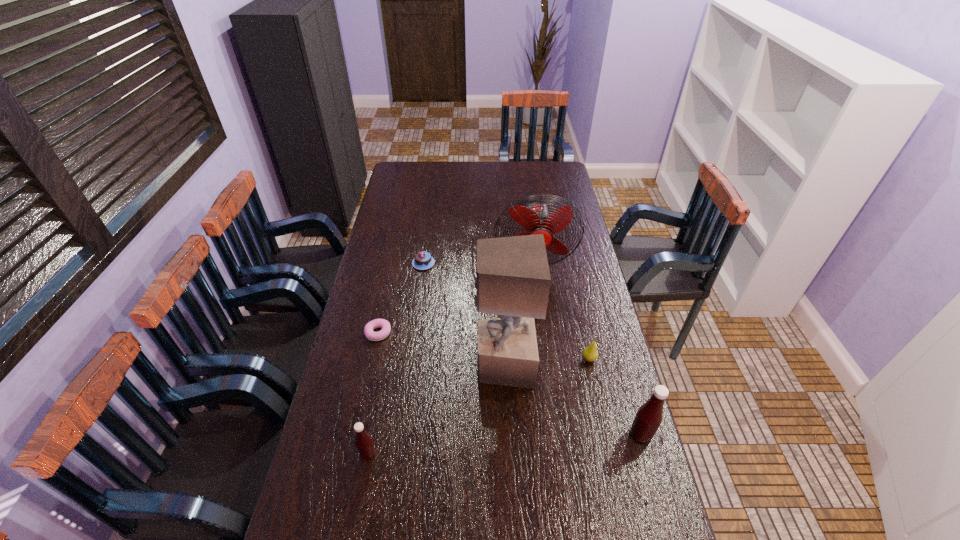
This screenshot has width=960, height=540. Identify the location of pastry that is positioned at the left edge. (377, 323).

Identify the location of Tabasco sauce situated at the right edge. (649, 416).

Where is `fan that is at the right edge`? fan that is at the right edge is located at coordinates pyautogui.click(x=536, y=219).

The image size is (960, 540). In order to click on pear situated at the right edge in this screenshot , I will do `click(590, 353)`.

The height and width of the screenshot is (540, 960). In order to click on vacant space at the far edge of the desktop in this screenshot , I will do `click(503, 184)`.

In the image, there is a desktop. Find the location of `free space at the left edge`. free space at the left edge is located at coordinates (393, 289).

Find the location of a particular element. vacant space at the right edge is located at coordinates coord(587,363).

At what (x,y) coordinates should I click in order to perform the action: click on vacant region at the far left corner of the desktop. Please return your answer as a coordinate pair (x, y). This screenshot has height=540, width=960. Looking at the image, I should click on (427, 161).

This screenshot has width=960, height=540. In order to click on empty location between the fifth shortest object and the sculpture in this screenshot , I will do `click(572, 400)`.

Identify the location of free space between the chocolate cake and the shortest object. (401, 298).